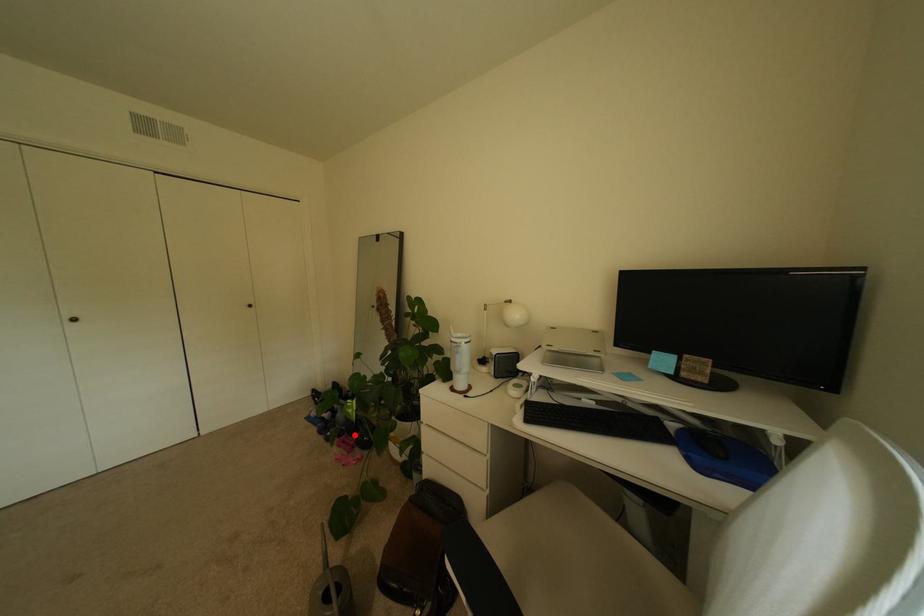
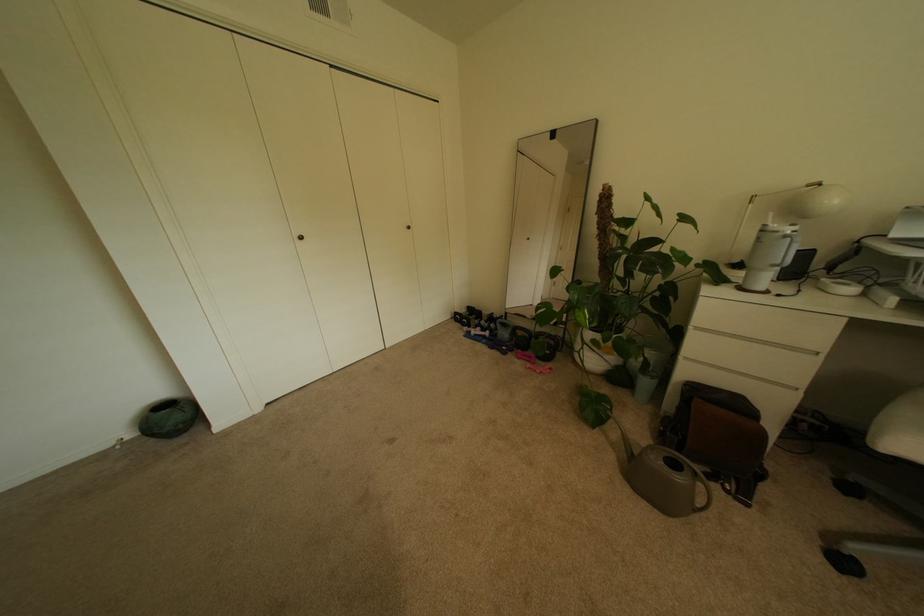
Where in the second image is the point corresponding to the highlighted location from the first image?

(524, 350)